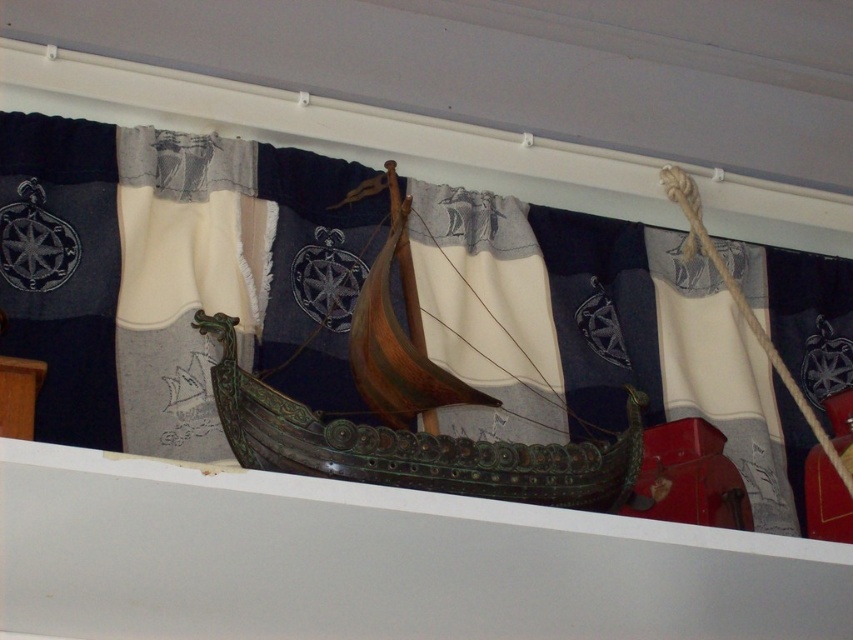
Is point (561, 458) closer to viewer compared to point (161, 243)?

Yes, point (561, 458) is in front of point (161, 243).

Is wooden ship at center smaller than white textured fabric at left?

Correct, wooden ship at center occupies less space than white textured fabric at left.

Measure the distance between wooden ship at center and camera.

wooden ship at center is 14.56 meters away from camera.

Identify the location of wooden ship at center. (409, 413).

Between dark blue fabric with nautical symbols at center and wooden ship at center, which one has less height?

wooden ship at center is shorter.

Identify the location of dark blue fabric with nautical symbols at center. (173, 275).

Between point (165, 358) and point (216, 400), which one is positioned behind?

The point (165, 358) is behind.

The height and width of the screenshot is (640, 853). I want to click on dark blue fabric with nautical symbols at center, so click(173, 275).

Does dark blue fabric with nautical symbols at center lie behind white textured fabric at left?

That is True.

Image resolution: width=853 pixels, height=640 pixels. Describe the element at coordinates (173, 275) in the screenshot. I see `dark blue fabric with nautical symbols at center` at that location.

What are the coordinates of `dark blue fabric with nautical symbols at center` in the screenshot? It's located at (173, 275).

Find the location of `dark blue fabric with nautical symbols at center`. dark blue fabric with nautical symbols at center is located at coordinates (173, 275).